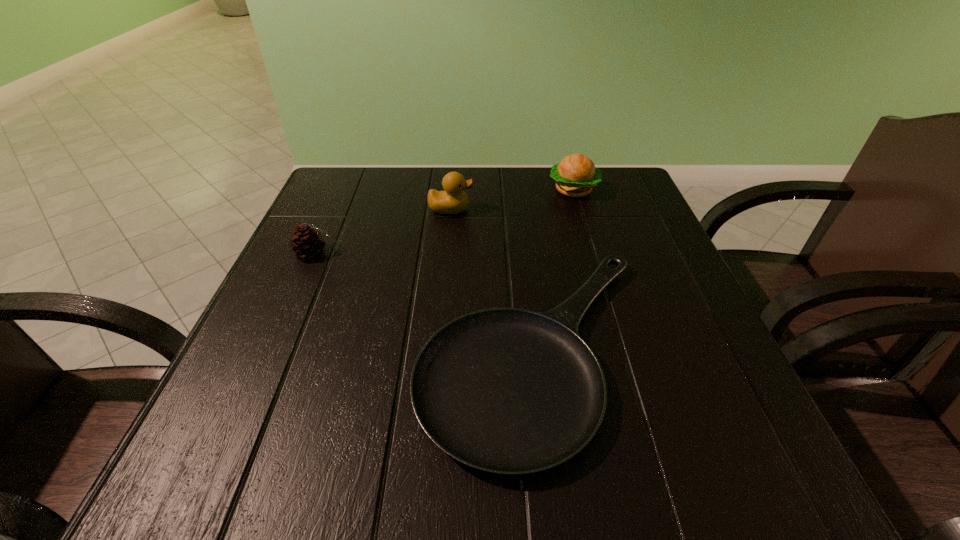
Find the location of a particular element. vacant space at the left edge of the desktop is located at coordinates (288, 282).

Image resolution: width=960 pixels, height=540 pixels. Find the location of `blank space at the right edge of the desktop`. blank space at the right edge of the desktop is located at coordinates (626, 338).

This screenshot has height=540, width=960. Find the location of `vacant space at the far left corner of the desktop`. vacant space at the far left corner of the desktop is located at coordinates (366, 173).

You are a GUI agent. You are given a task and a screenshot of the screen. Output one action in this format:
    pyautogui.click(x=<x>, y=<y>)
    Task: Click on the free location at the far right corner of the desktop
    This screenshot has width=960, height=540.
    Given the screenshot: What is the action you would take?
    pyautogui.click(x=605, y=211)

In the image, there is a desktop. In order to click on vacant area at the near right corner in this screenshot , I will do `click(685, 481)`.

Where is `vacant space in between the hamburger and the nearest object`? This screenshot has height=540, width=960. vacant space in between the hamburger and the nearest object is located at coordinates (555, 270).

The height and width of the screenshot is (540, 960). Find the location of `free space between the third tallest object and the hamburger`. free space between the third tallest object and the hamburger is located at coordinates (444, 221).

Where is `free point between the nearest object and the duckling`? The height and width of the screenshot is (540, 960). free point between the nearest object and the duckling is located at coordinates (493, 279).

The height and width of the screenshot is (540, 960). Find the location of `vacant region between the pinecone and the duckling`. vacant region between the pinecone and the duckling is located at coordinates (382, 231).

Image resolution: width=960 pixels, height=540 pixels. I want to click on empty space between the shortest object and the hamburger, so click(555, 270).